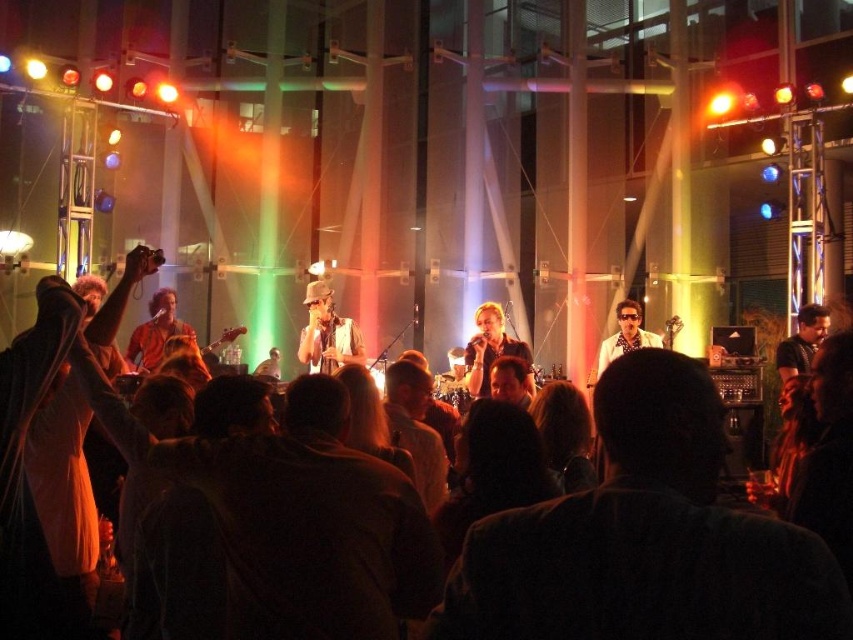
Is matte gray harmonica at center thinner than matte black microphone at center?

Answer: In fact, matte gray harmonica at center might be wider than matte black microphone at center.

This screenshot has width=853, height=640. What do you see at coordinates (328, 333) in the screenshot? I see `matte gray harmonica at center` at bounding box center [328, 333].

What are the coordinates of `matte gray harmonica at center` in the screenshot? It's located at (328, 333).

Who is shorter, matte black microphone at center or white glossy shirt at center?

matte black microphone at center

Who is taller, matte black microphone at center or white glossy shirt at center?

white glossy shirt at center

Is point (521, 340) positioned in front of point (593, 381)?

No, it is behind (593, 381).

I want to click on matte black microphone at center, so click(x=492, y=349).

Is dark brown leather jacket at lower center below matte black microphone at center?

Correct, dark brown leather jacket at lower center is located below matte black microphone at center.

Is point (506, 621) farther from viewer compared to point (474, 348)?

No, (506, 621) is in front of (474, 348).

You are a GUI agent. You are given a task and a screenshot of the screen. Output one action in this format:
    pyautogui.click(x=<x>, y=<y>)
    Task: Click on the dark brown leather jacket at lower center
    
    Given the screenshot: What is the action you would take?
    pyautogui.click(x=645, y=538)